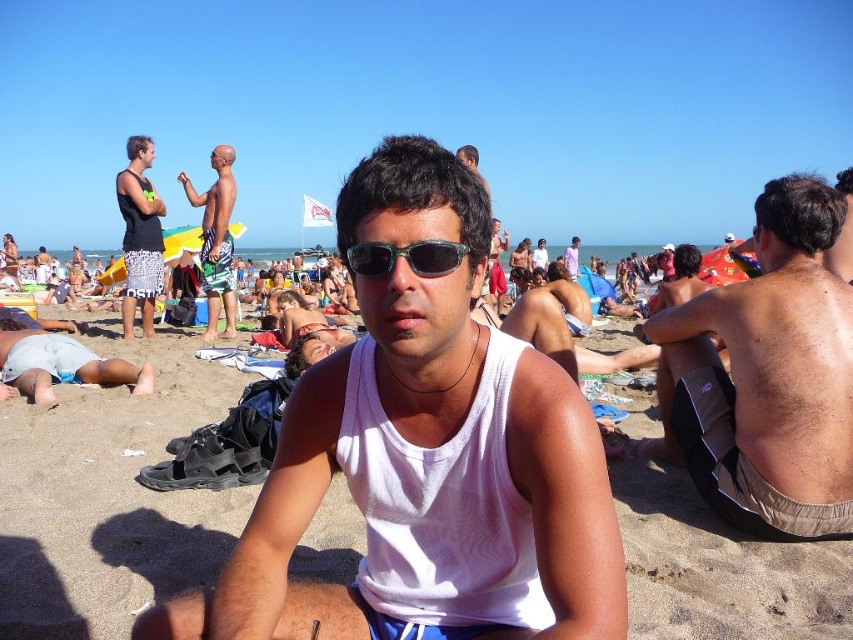
Who is shorter, matte black tank top at left or matte black sunglasses at upper center?

matte black tank top at left

Can you confirm if matte black tank top at left is thinner than matte black sunglasses at upper center?

Yes.

The height and width of the screenshot is (640, 853). Identify the location of matte black tank top at left. (140, 236).

Where is `matte black tank top at left`? matte black tank top at left is located at coordinates (140, 236).

Does point (230, 188) lie in front of point (463, 148)?

No.

Is green striped shorts at center shorter than matte black sunglasses at upper center?

Indeed, green striped shorts at center has a lesser height compared to matte black sunglasses at upper center.

What do you see at coordinates (216, 240) in the screenshot?
I see `green striped shorts at center` at bounding box center [216, 240].

Identify the location of green striped shorts at center. The width and height of the screenshot is (853, 640). (216, 240).

Does white matte tank top at center appear over matte black sunglasses at upper center?

No, white matte tank top at center is not above matte black sunglasses at upper center.

In the scene shown: Is white matte tank top at center bigger than matte black sunglasses at upper center?

No, white matte tank top at center is not bigger than matte black sunglasses at upper center.

At what (x,y) coordinates should I click in order to perform the action: click on white matte tank top at center. Please return your answer as a coordinate pair (x, y). The image size is (853, 640). Looking at the image, I should click on (426, 458).